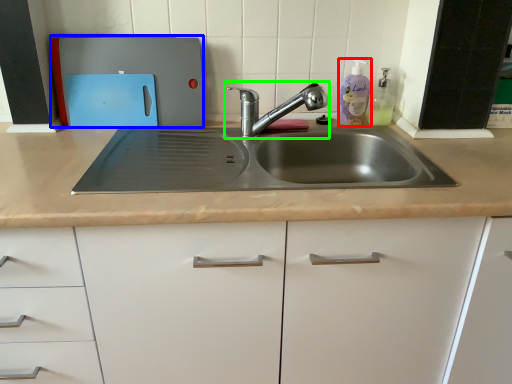
Question: Based on their relative distances, which object is nearer to cleaning product (highlighted by a red box)? Choose from appliance (highlighted by a blue box) and tap (highlighted by a green box).

Choices:
 (A) appliance
 (B) tap

Answer: (B)